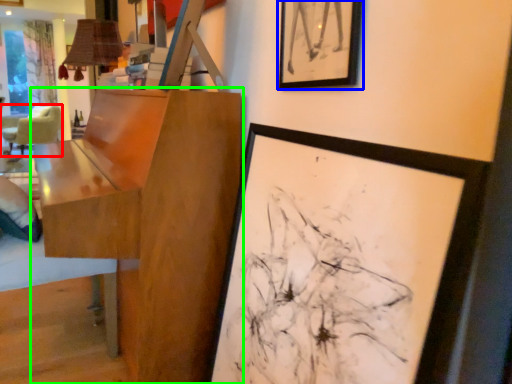
Question: Which is nearer to the chair (highlighted by a red box)? picture frame (highlighted by a blue box) or table (highlighted by a green box).

Choices:
 (A) picture frame
 (B) table

Answer: (B)